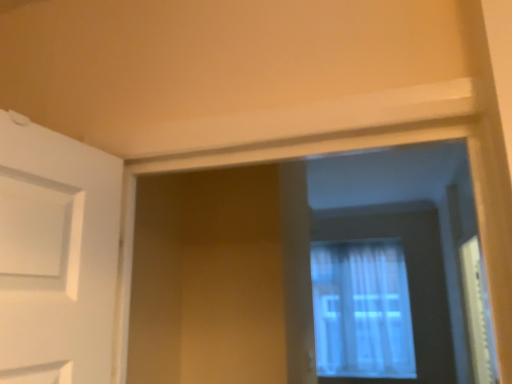
At what (x,y) coordinates should I click in order to perform the action: click on transparent glass window at center. Please return your answer as a coordinate pair (x, y). The image size is (512, 384). Looking at the image, I should click on (412, 281).

The image size is (512, 384). Describe the element at coordinates (412, 281) in the screenshot. I see `transparent glass window at center` at that location.

What is the approximate width of transparent glass window at center?

transparent glass window at center is 8.25 inches in width.

The width and height of the screenshot is (512, 384). I want to click on transparent glass window at center, so click(412, 281).